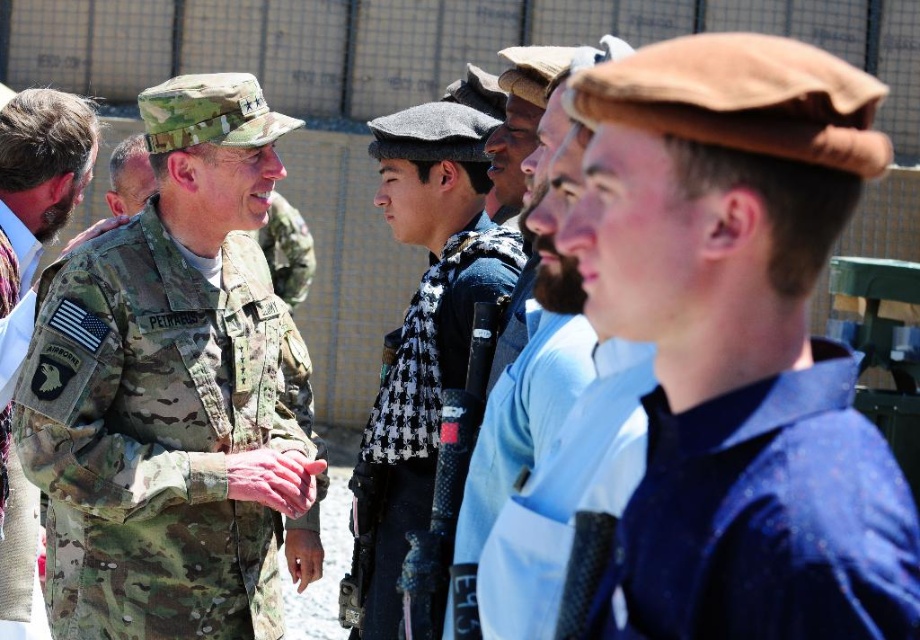
You are a photographer at the event and want to ensure both the brown felt cap at center and the camouflage uniform at center are clearly visible in your photo. Which object should you focus on to capture more detail due to its larger size?

The camouflage uniform at center is larger in width than the brown felt cap at center, so focusing on the camouflage uniform at center will allow you to capture more detail due to its larger size.

You are a photographer standing at the scene. You want to take a closeup photo of the brown felt cap at center. The camera you are using has a minimum focusing distance of 5 meters. Can you take the photo without moving closer?

The brown felt cap at center is 6.12 meters away from the camera. Since the minimum focusing distance is 5 meters, the camera can focus on the brown felt cap at center from this distance, so yes, you can take the closeup photo without moving closer.

You are a photographer at this event and want to capture a clear photo of the camouflage uniform at center without the brown felt cap at center blocking it. How should you adjust your camera angle?

The brown felt cap at center is located above the camouflage uniform at center, so you should lower your camera angle to avoid the cap blocking the uniform.